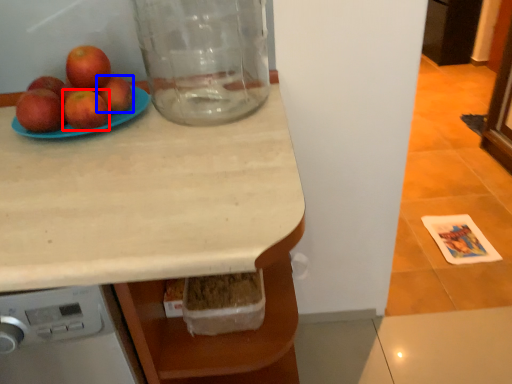
Question: Which of the following is the closest to the observer, apple (highlighted by a red box) or apple (highlighted by a blue box)?

Choices:
 (A) apple
 (B) apple

Answer: (A)